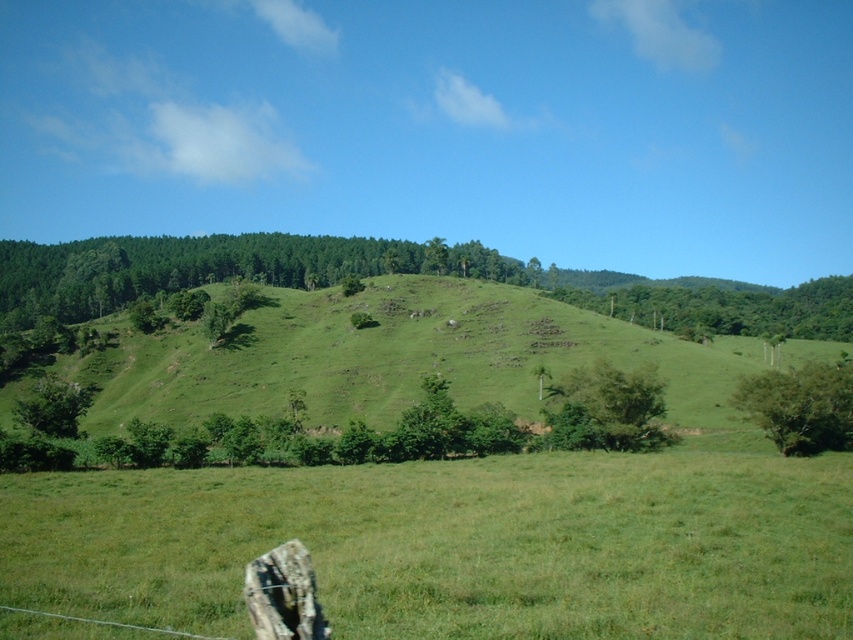
Looking at this image, does green grassy field at center appear over green leafy tree at center?

Yes.

Describe the element at coordinates (453, 545) in the screenshot. Image resolution: width=853 pixels, height=640 pixels. I see `green grassy field at center` at that location.

You are a GUI agent. You are given a task and a screenshot of the screen. Output one action in this format:
    pyautogui.click(x=<x>, y=<y>)
    Task: Click on the green grassy field at center
    Image resolution: width=853 pixels, height=640 pixels.
    Given the screenshot: What is the action you would take?
    pyautogui.click(x=453, y=545)

Find the location of a particular element. The width and height of the screenshot is (853, 640). green grassy field at center is located at coordinates (453, 545).

Does green grassy hillside at center have a lesser width compared to green leafy tree at center?

No.

Is green grassy hillside at center to the right of green leafy tree at center from the viewer's perspective?

Incorrect, green grassy hillside at center is not on the right side of green leafy tree at center.

Measure the distance between point (213, 374) and camera.

Point (213, 374) and camera are 432.17 feet apart from each other.

The image size is (853, 640). What are the coordinates of `green grassy hillside at center` in the screenshot? It's located at (393, 356).

This screenshot has height=640, width=853. What do you see at coordinates (393, 356) in the screenshot?
I see `green grassy hillside at center` at bounding box center [393, 356].

Who is more forward, [257,349] or [833,385]?

Answer: Point [833,385] is in front.

Find the location of a particular element. This screenshot has height=640, width=853. green grassy hillside at center is located at coordinates (393, 356).